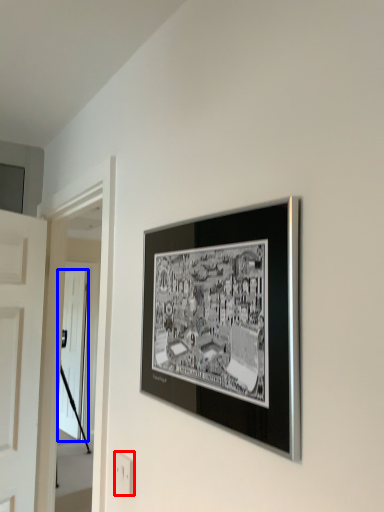
Question: Among these objects, which one is nearest to the camera, electric outlet (highlighted by a red box) or door (highlighted by a blue box)?

Choices:
 (A) electric outlet
 (B) door

Answer: (A)